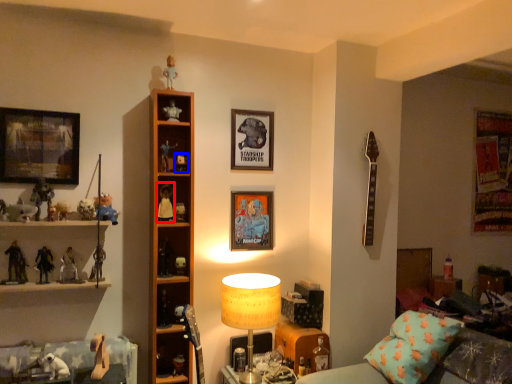
Question: Which point is further to the camera, toy (highlighted by a red box) or toy (highlighted by a blue box)?

Choices:
 (A) toy
 (B) toy

Answer: (B)